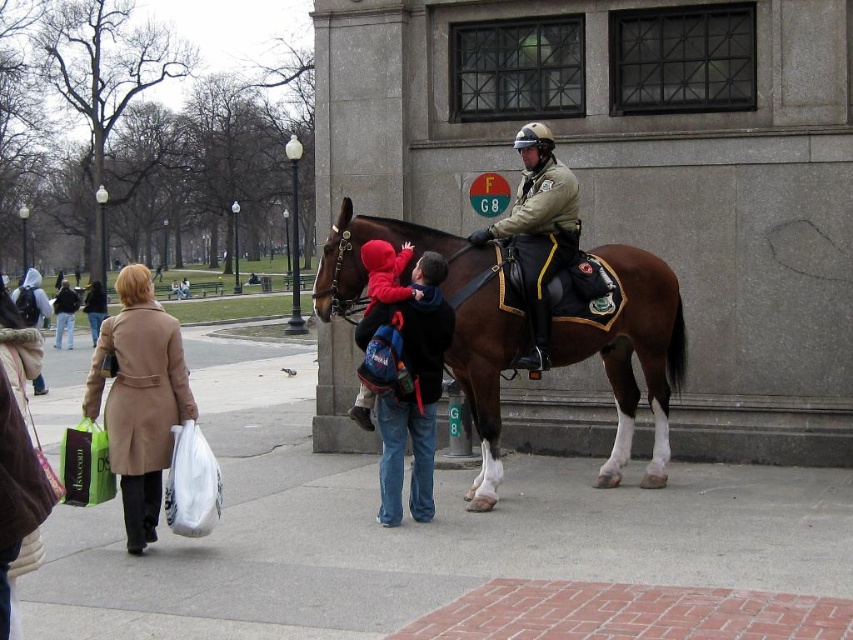
You are standing in the outdoor urban scene described. There are two points marked in the image, one at coordinates point (x=461, y=326) and the other at point (x=558, y=193). Which point is nearer to you?

Point (x=461, y=326) is closer to the viewer than point (x=558, y=193).

You are standing at the origin point in the image. The brown glossy horse at center is located at coordinates point (454, 317). If you want to approach the brown glossy horse at center, which direction should you move from your current position?

The brown glossy horse at center is located at coordinates point (454, 317), so you should move towards that coordinate point to reach it.